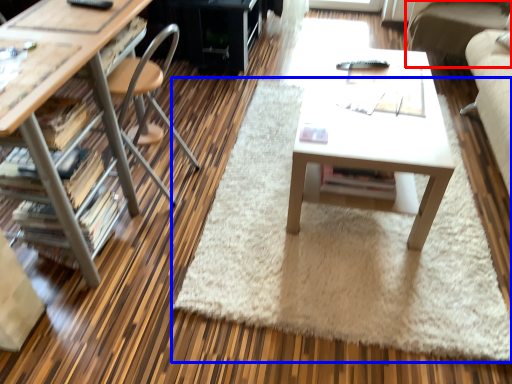
Question: Which object is closer to the camera taking this photo, couch (highlighted by a red box) or mat (highlighted by a blue box)?

Choices:
 (A) couch
 (B) mat

Answer: (B)